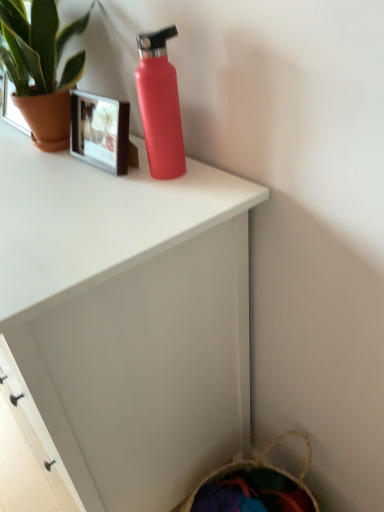
Question: Does green matte plant at upper left have a larger size compared to matte pink bottle at upper center?

Choices:
 (A) no
 (B) yes

Answer: (B)

Question: From a real-world perspective, does green matte plant at upper left stand above matte pink bottle at upper center?

Choices:
 (A) no
 (B) yes

Answer: (B)

Question: Is the surface of green matte plant at upper left in direct contact with matte pink bottle at upper center?

Choices:
 (A) no
 (B) yes

Answer: (A)

Question: Does green matte plant at upper left appear on the left side of matte pink bottle at upper center?

Choices:
 (A) no
 (B) yes

Answer: (B)

Question: Would you say matte pink bottle at upper center is part of green matte plant at upper left's contents?

Choices:
 (A) yes
 (B) no

Answer: (B)

Question: Can you confirm if green matte plant at upper left is thinner than matte pink bottle at upper center?

Choices:
 (A) yes
 (B) no

Answer: (B)

Question: From a real-world perspective, does matte pink bottle at upper center sit lower than matte red water bottle at upper center?

Choices:
 (A) no
 (B) yes

Answer: (A)

Question: Does matte pink bottle at upper center have a greater height compared to matte red water bottle at upper center?

Choices:
 (A) yes
 (B) no

Answer: (B)

Question: Is the depth of matte pink bottle at upper center greater than that of matte red water bottle at upper center?

Choices:
 (A) no
 (B) yes

Answer: (B)

Question: Is there a large distance between matte pink bottle at upper center and matte red water bottle at upper center?

Choices:
 (A) no
 (B) yes

Answer: (A)

Question: Does matte pink bottle at upper center have a lesser height compared to matte red water bottle at upper center?

Choices:
 (A) no
 (B) yes

Answer: (B)

Question: Are matte pink bottle at upper center and matte red water bottle at upper center beside each other?

Choices:
 (A) yes
 (B) no

Answer: (B)

Question: Is green matte plant at upper left smaller than matte red water bottle at upper center?

Choices:
 (A) no
 (B) yes

Answer: (B)